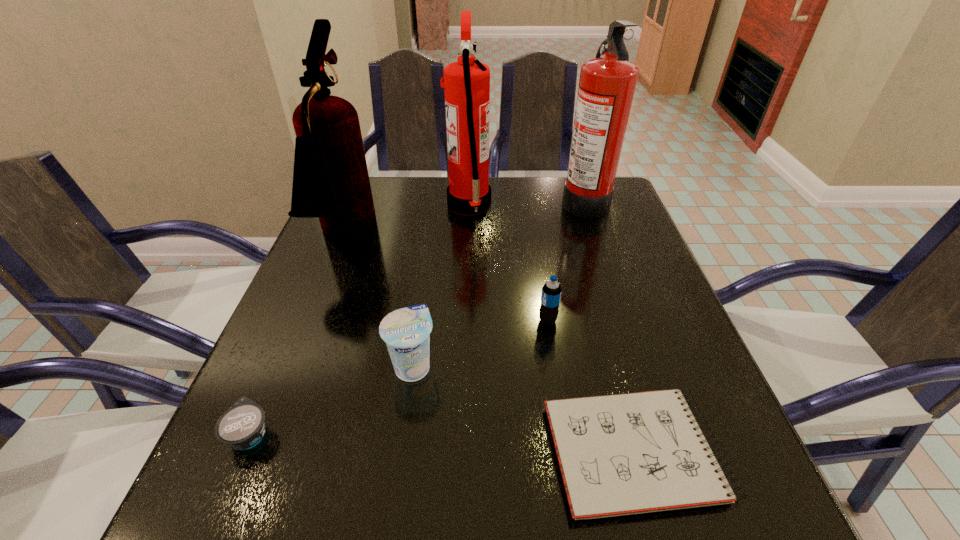
Find the location of a particular element. The height and width of the screenshot is (540, 960). free space located on the front-facing side of the rightmost fire extinguisher is located at coordinates (521, 200).

Identify the location of free space located on the front-facing side of the rightmost fire extinguisher. The width and height of the screenshot is (960, 540). (457, 200).

Locate an element on the screen. This screenshot has width=960, height=540. blank area located with the nozzle aimed from the second fire extinguisher from right to left is located at coordinates (531, 205).

At what (x,y) coordinates should I click in order to perform the action: click on vacant space located at the nozzle of the leftmost fire extinguisher. Please return your answer as a coordinate pair (x, y). The image size is (960, 540). Looking at the image, I should click on (473, 236).

The image size is (960, 540). I want to click on vacant space located on the left of the soda bottle, so click(x=389, y=321).

Identify the location of free spot located on the right of the farther yogurt. The image size is (960, 540). (641, 366).

You are a GUI agent. You are given a task and a screenshot of the screen. Output one action in this format:
    pyautogui.click(x=<x>, y=<y>)
    Task: Click on the free location located 0.120m on the back of the shorter yogurt
    This screenshot has width=960, height=540.
    Given the screenshot: What is the action you would take?
    pyautogui.click(x=284, y=354)

In order to click on vacant space located on the left of the shortest object in this screenshot , I will do `click(321, 453)`.

This screenshot has width=960, height=540. I want to click on object positioned at the near edge, so click(x=621, y=454).

This screenshot has height=540, width=960. What are the coordinates of `fire extinguisher located in the left edge section of the desktop` in the screenshot? It's located at (330, 178).